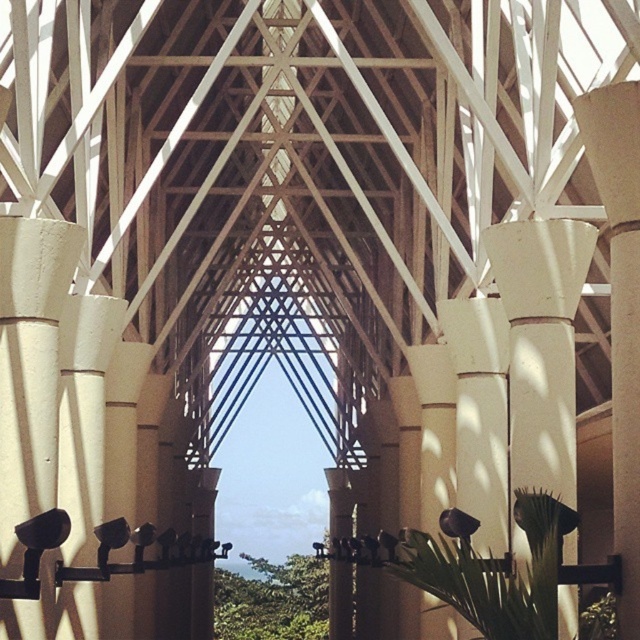
Is white concrete column at center taller than white smooth column at right?

Incorrect, white concrete column at center's height is not larger of white smooth column at right's.

Between point (540, 365) and point (609, 180), which one is positioned in front?

Point (609, 180)

Describe the element at coordinates (541, 344) in the screenshot. I see `white concrete column at center` at that location.

I want to click on white concrete column at center, so click(x=541, y=344).